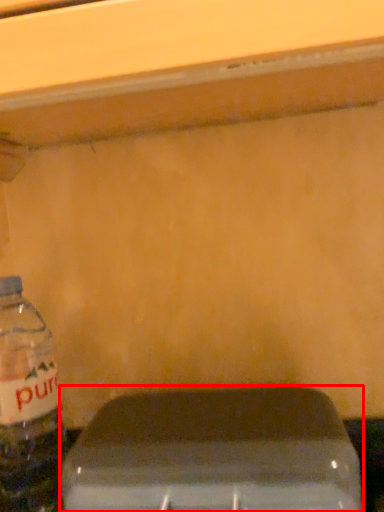
Question: From the image's perspective, what is the correct spatial relationship of appliance (annotated by the red box) in relation to bottle?

Choices:
 (A) below
 (B) above

Answer: (A)